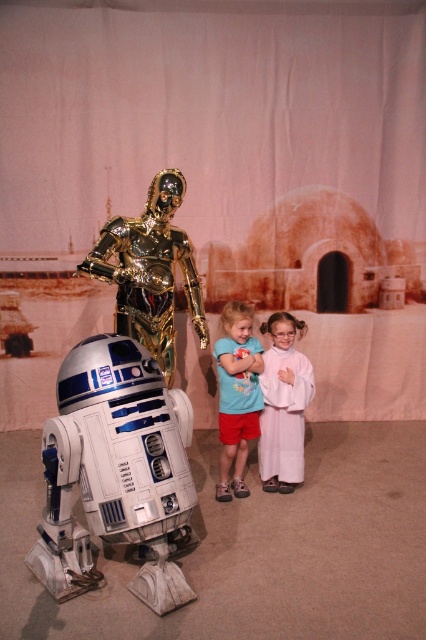
Question: Which of the following is the closest to the observer?

Choices:
 (A) blue cotton shirt at center
 (B) gold metallic astronaut at center
 (C) white satin dress at center

Answer: (B)

Question: Which point is farther to the camera?

Choices:
 (A) blue cotton shirt at center
 (B) gold metallic astronaut at center
 (C) white satin dress at center
 (D) silver metallic droid at lower left

Answer: (C)

Question: Can you confirm if silver metallic droid at lower left is bigger than gold metallic astronaut at center?

Choices:
 (A) no
 (B) yes

Answer: (B)

Question: Which object is closer to the camera taking this photo?

Choices:
 (A) silver metallic droid at lower left
 (B) white satin dress at center
 (C) blue cotton shirt at center

Answer: (A)

Question: Does gold metallic astronaut at center appear under blue cotton shirt at center?

Choices:
 (A) yes
 (B) no

Answer: (B)

Question: Where is silver metallic droid at lower left located in relation to white satin dress at center in the image?

Choices:
 (A) left
 (B) right

Answer: (A)